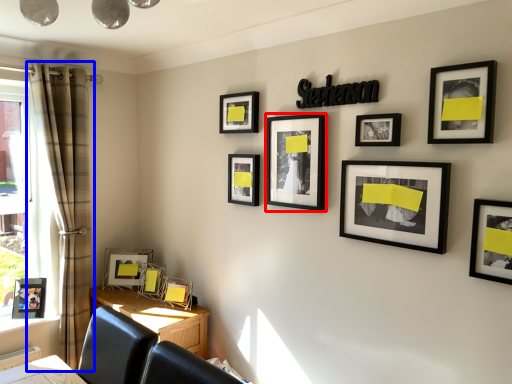
Question: Which point is further to the camera, picture frame (highlighted by a red box) or curtain (highlighted by a blue box)?

Choices:
 (A) picture frame
 (B) curtain

Answer: (B)